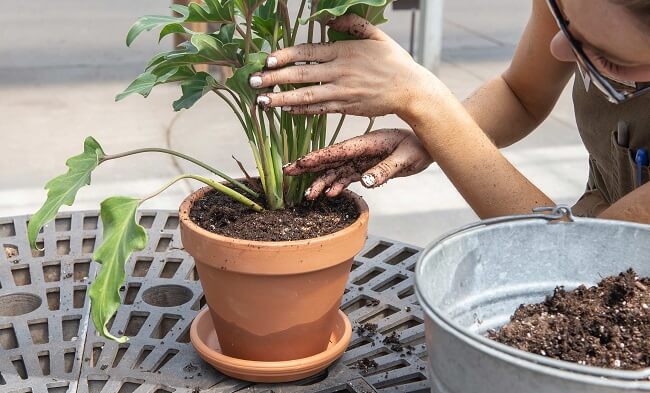
Find the location of `metal grated table`. metal grated table is located at coordinates (162, 341).